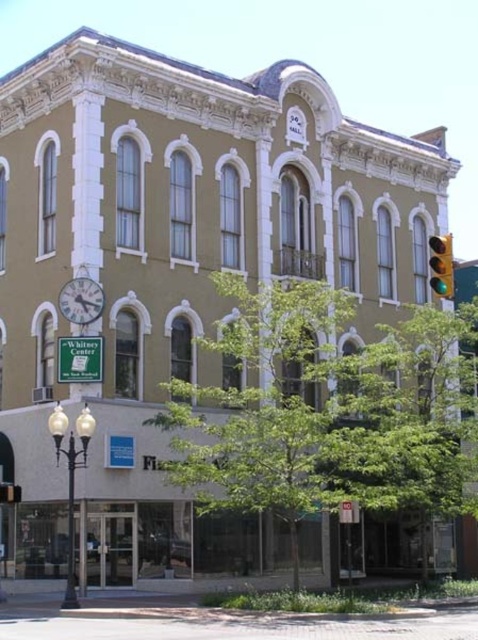
You are standing in front of the Whitney Center building and want to take a photo. You notice two points marked on the building facade at coordinates point [91,280] and point [441,264]. Which point is closer to your camera lens when taking the photo?

The point [91,280] is closer to the camera lens because it is further to the camera than point [441,264], which is farther away.

You are a delivery driver approaching the Whitney Center and need to park your vehicle. The parking spot is between the metallic silver clock at upper left and the green glass traffic light at right. Can you estimate which object is smaller in size to ensure your vehicle doesn

The metallic silver clock at upper left occupies less space than the green glass traffic light at right, so the metallic silver clock at upper left is smaller in size. This means the parking spot between them is closer to the smaller object.

Looking at this image, you are standing in front of the Whitney Center building. You see the metallic silver clock at upper left. Where is the clock positioned relative to the building?

The metallic silver clock at upper left is located at point 0.470 on the horizontal axis and 0.169 on the vertical axis relative to the building.